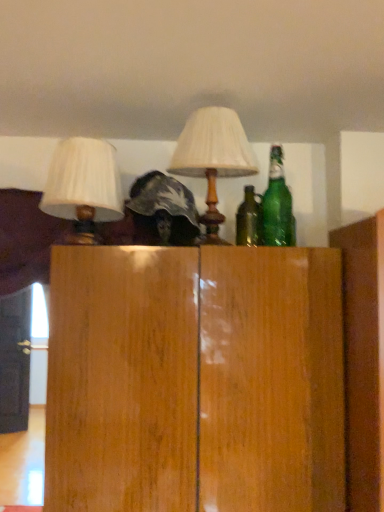
Question: Is white fabric lampshade at upper left, which ranks as the 1th lamp in left-to-right order, oriented away from matte white lampshade at center, the 1th lamp when ordered from right to left?

Choices:
 (A) yes
 (B) no

Answer: (B)

Question: Is the surface of white fabric lampshade at upper left, the 2th lamp from the right, in direct contact with matte white lampshade at center, which appears as the 2th lamp when viewed from the left?

Choices:
 (A) yes
 (B) no

Answer: (B)

Question: Considering the relative sizes of white fabric lampshade at upper left, the 2th lamp from the right, and matte white lampshade at center, which appears as the 2th lamp when viewed from the left, in the image provided, is white fabric lampshade at upper left, the 2th lamp from the right, smaller than matte white lampshade at center, which appears as the 2th lamp when viewed from the left,?

Choices:
 (A) no
 (B) yes

Answer: (B)

Question: Is white fabric lampshade at upper left, the 2th lamp from the right, oriented towards matte white lampshade at center, the 1th lamp when ordered from right to left?

Choices:
 (A) yes
 (B) no

Answer: (B)

Question: Can matte white lampshade at center, the 1th lamp when ordered from right to left, be found inside white fabric lampshade at upper left, the 2th lamp from the right?

Choices:
 (A) yes
 (B) no

Answer: (B)

Question: From a real-world perspective, is white fabric lampshade at upper left, which ranks as the 1th lamp in left-to-right order, located higher than matte white lampshade at center, which appears as the 2th lamp when viewed from the left?

Choices:
 (A) yes
 (B) no

Answer: (B)

Question: Would you consider green glass bottle at upper right to be distant from white fabric lampshade at upper left, which ranks as the 1th lamp in left-to-right order?

Choices:
 (A) no
 (B) yes

Answer: (A)

Question: Is white fabric lampshade at upper left, which ranks as the 1th lamp in left-to-right order, surrounded by green glass bottle at upper right?

Choices:
 (A) yes
 (B) no

Answer: (B)

Question: Is green glass bottle at upper right oriented towards white fabric lampshade at upper left, the 2th lamp from the right?

Choices:
 (A) no
 (B) yes

Answer: (A)

Question: From the image's perspective, does green glass bottle at upper right appear higher than white fabric lampshade at upper left, which ranks as the 1th lamp in left-to-right order?

Choices:
 (A) yes
 (B) no

Answer: (A)

Question: Does green glass bottle at upper right come behind white fabric lampshade at upper left, the 2th lamp from the right?

Choices:
 (A) no
 (B) yes

Answer: (B)

Question: Is green glass bottle at upper right thinner than white fabric lampshade at upper left, the 2th lamp from the right?

Choices:
 (A) no
 (B) yes

Answer: (B)

Question: Are green glass bottle at upper right and matte white lampshade at center, the 1th lamp when ordered from right to left, making contact?

Choices:
 (A) yes
 (B) no

Answer: (B)